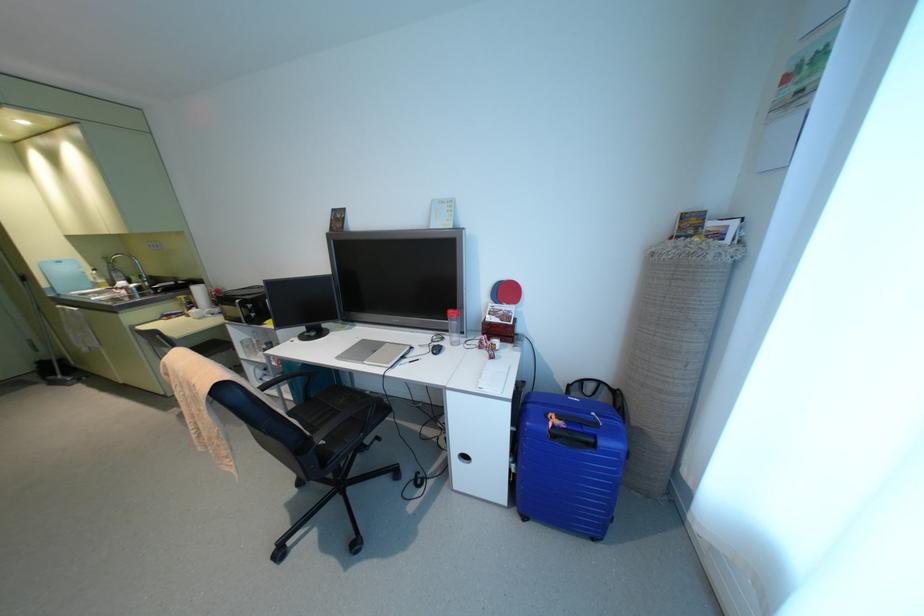
Find the location of `black backpack handle`. black backpack handle is located at coordinates (590, 387).